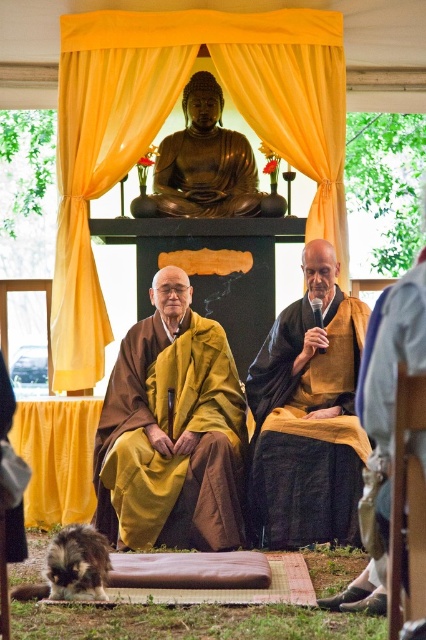
Question: Where is yellow sheer curtain at upper center located in relation to brown textured robe at lower right in the image?

Choices:
 (A) below
 (B) above

Answer: (B)

Question: Among these objects, which one is nearest to the camera?

Choices:
 (A) yellow-orange robe at center
 (B) brown textured robe at lower right
 (C) gold polished statue at center

Answer: (B)

Question: Which object is the farthest from the yellow matte robe at center?

Choices:
 (A) yellow sheer curtain at upper center
 (B) yellow-orange robe at center
 (C) brown textured robe at lower right
 (D) gold polished statue at center

Answer: (D)

Question: Can you confirm if yellow sheer curtain at upper center is wider than brown textured robe at lower right?

Choices:
 (A) yes
 (B) no

Answer: (A)

Question: In this image, where is yellow-orange robe at center located relative to brown matte robe at center?

Choices:
 (A) left
 (B) right

Answer: (A)

Question: Which object appears closest to the camera in this image?

Choices:
 (A) brown matte robe at center
 (B) gold polished statue at center
 (C) yellow-orange robe at center

Answer: (A)